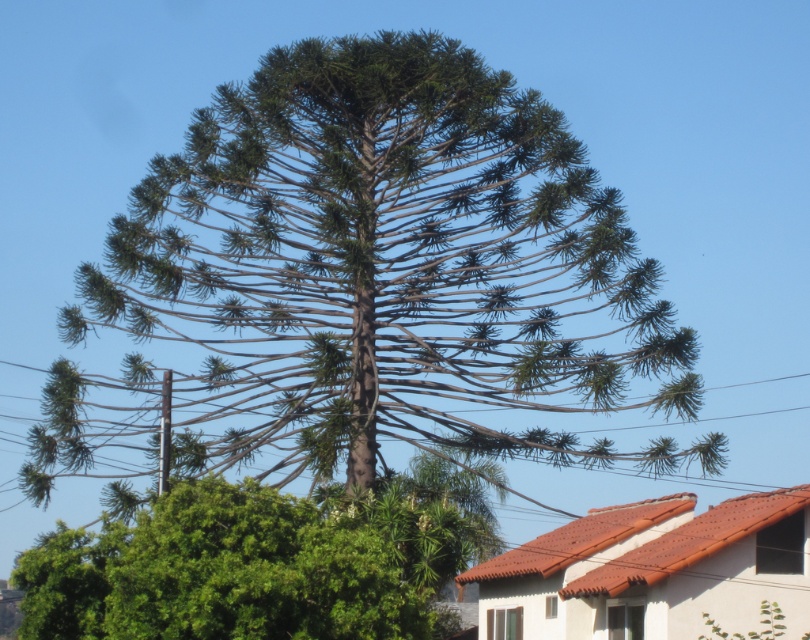
Question: Is green textured tree at center in front of green leafy tree at lower left?

Choices:
 (A) yes
 (B) no

Answer: (B)

Question: Which point appears farthest from the camera in this image?

Choices:
 (A) (342, 266)
 (B) (666, 401)
 (C) (276, 596)

Answer: (B)

Question: Observing the image, what is the correct spatial positioning of green textured tree at center in reference to green leafy tree at lower left?

Choices:
 (A) below
 (B) above

Answer: (B)

Question: Where is green textured tree at center located in relation to metallic wire at center in the image?

Choices:
 (A) left
 (B) right

Answer: (B)

Question: Which is nearer to the metallic wire at center?

Choices:
 (A) green leafy tree at lower left
 (B) green textured tree at center

Answer: (B)

Question: Among these objects, which one is farthest from the camera?

Choices:
 (A) metallic wire at center
 (B) green leafy tree at lower left
 (C) green textured tree at center

Answer: (A)